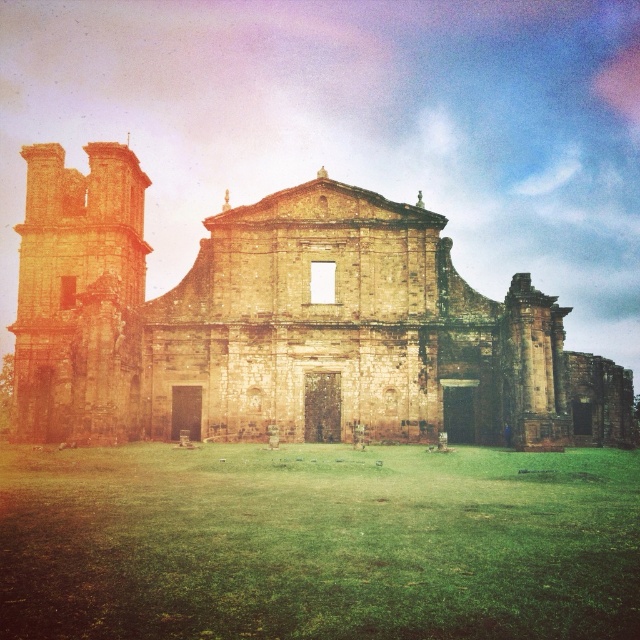
In the scene shown: You are standing in front of the brown stone church at center and the green grass at center. Which one is taller?

The brown stone church at center is taller than the green grass at center.

You are standing in front of the brown stone church at center and the green grass at center. Which object is positioned to the left?

The brown stone church at center is to the left of the green grass at center.